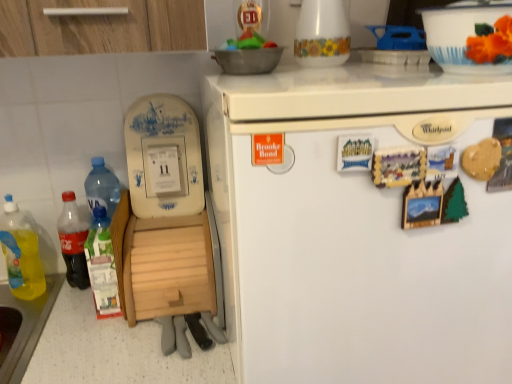
Measure the distance between point (423, 10) and camera.

1.07 meters.

What do you see at coordinates (73, 241) in the screenshot? I see `translucent plastic soda bottle at left, marked as the second bottle in a right-to-left arrangement` at bounding box center [73, 241].

The width and height of the screenshot is (512, 384). Identify the location of wooden at left. (170, 272).

Where is `white ceramic vase at upper center`? The image size is (512, 384). white ceramic vase at upper center is located at coordinates (322, 34).

Is wooden at left behind white ceramic vase at upper center?

Yes, wooden at left is behind white ceramic vase at upper center.

Is wooden at left inside or outside of white ceramic vase at upper center?

The correct answer is: outside.

Where is `appliance above the wooden at left (from a real-world perspective)`? The height and width of the screenshot is (384, 512). appliance above the wooden at left (from a real-world perspective) is located at coordinates (322, 34).

Is wooden at left directly adjacent to white ceramic vase at upper center?

No, wooden at left is not making contact with white ceramic vase at upper center.

From a real-world perspective, is translucent plastic soda bottle at left, marked as the second bottle in a right-to-left arrangement, over yellow translucent liquid at lower left, which appears as the 3th bottle when viewed from the right?

Yes, from a real-world perspective, translucent plastic soda bottle at left, marked as the second bottle in a right-to-left arrangement, is above yellow translucent liquid at lower left, which appears as the 3th bottle when viewed from the right.

Considering the sizes of objects translucent plastic soda bottle at left, marked as the second bottle in a right-to-left arrangement, and yellow translucent liquid at lower left, positioned as the first bottle in left-to-right order, in the image provided, who is bigger, translucent plastic soda bottle at left, marked as the second bottle in a right-to-left arrangement, or yellow translucent liquid at lower left, positioned as the first bottle in left-to-right order,?

With larger size is yellow translucent liquid at lower left, positioned as the first bottle in left-to-right order.

Is the surface of translucent plastic soda bottle at left, the second bottle viewed from the left, in direct contact with yellow translucent liquid at lower left, which appears as the 3th bottle when viewed from the right?

No, translucent plastic soda bottle at left, the second bottle viewed from the left, is not next to yellow translucent liquid at lower left, which appears as the 3th bottle when viewed from the right.

Is yellow translucent liquid at lower left, positioned as the first bottle in left-to-right order, at the back of translucent plastic soda bottle at left, the second bottle viewed from the left?

No, translucent plastic soda bottle at left, the second bottle viewed from the left, is not facing the opposite direction of yellow translucent liquid at lower left, positioned as the first bottle in left-to-right order.

Is white glossy bowl at upper right oriented towards wooden at left?

No, white glossy bowl at upper right is not aimed at wooden at left.

From a real-world perspective, which object rests below the other?

wooden at left.

Is white glossy bowl at upper right at the right side of wooden at left?

Indeed, white glossy bowl at upper right is positioned on the right side of wooden at left.

Which is behind, yellow translucent liquid at lower left, which appears as the 3th bottle when viewed from the right, or translucent plastic bottle at lower left, arranged as the first bottle when viewed from the right?

translucent plastic bottle at lower left, arranged as the first bottle when viewed from the right, is more distant.

Locate an element on the screen. bottle that is in front of the translucent plastic bottle at lower left, arranged as the first bottle when viewed from the right is located at coordinates (21, 253).

Is yellow translucent liquid at lower left, positioned as the first bottle in left-to-right order, with translucent plastic bottle at lower left, placed as the 3th bottle when sorted from left to right?

No, yellow translucent liquid at lower left, positioned as the first bottle in left-to-right order, is not touching translucent plastic bottle at lower left, placed as the 3th bottle when sorted from left to right.

From a real-world perspective, between white ceramic vase at upper center and wooden at left, who is vertically lower?

wooden at left is physically lower.

Consider the image. Would you say white ceramic vase at upper center is to the left or to the right of wooden at left in the picture?

Based on their positions, white ceramic vase at upper center is located to the right of wooden at left.

Is white ceramic vase at upper center oriented towards wooden at left?

No, white ceramic vase at upper center does not turn towards wooden at left.

I want to click on the 1st bottle positioned below the white glossy bowl at upper right (from a real-world perspective), so click(73, 241).

Is translucent plastic soda bottle at left, marked as the second bottle in a right-to-left arrangement, directly adjacent to white glossy bowl at upper right?

No, translucent plastic soda bottle at left, marked as the second bottle in a right-to-left arrangement, is not beside white glossy bowl at upper right.

From the image's perspective, is translucent plastic soda bottle at left, marked as the second bottle in a right-to-left arrangement, located beneath white glossy bowl at upper right?

Yes, from the image's perspective, translucent plastic soda bottle at left, marked as the second bottle in a right-to-left arrangement, is below white glossy bowl at upper right.

Does translucent plastic soda bottle at left, the second bottle viewed from the left, appear on the right side of white glossy bowl at upper right?

Incorrect, translucent plastic soda bottle at left, the second bottle viewed from the left, is not on the right side of white glossy bowl at upper right.

Locate an element on the screen. Image resolution: width=512 pixels, height=384 pixels. refrigerator located underneath the wooden at left (from a real-world perspective) is located at coordinates (357, 228).

Considering the sizes of objects wooden at left and white matte refrigerator at upper right in the image provided, who is bigger, wooden at left or white matte refrigerator at upper right?

Bigger between the two is white matte refrigerator at upper right.

Consider the image. From the image's perspective, which one is positioned lower, wooden at left or white matte refrigerator at upper right?

white matte refrigerator at upper right, from the image's perspective.

Is wooden at left to the left or to the right of white matte refrigerator at upper right in the image?

Clearly, wooden at left is on the left of white matte refrigerator at upper right in the image.

Identify the location of appliance above the wooden at left (from the image's perspective). (322, 34).

Where is `the 1st bottle to the right of the yellow translucent liquid at lower left, which appears as the 3th bottle when viewed from the right, starting your count from the anchor`? the 1st bottle to the right of the yellow translucent liquid at lower left, which appears as the 3th bottle when viewed from the right, starting your count from the anchor is located at coordinates (x=73, y=241).

When comparing their distances from translucent plastic soda bottle at left, the second bottle viewed from the left, does translucent plastic bottle at lower left, arranged as the first bottle when viewed from the right, or yellow translucent liquid at lower left, which appears as the 3th bottle when viewed from the right, seem closer?

Based on the image, yellow translucent liquid at lower left, which appears as the 3th bottle when viewed from the right, appears to be nearer to translucent plastic soda bottle at left, the second bottle viewed from the left.

Based on their spatial positions, is translucent plastic soda bottle at left, marked as the second bottle in a right-to-left arrangement, or translucent plastic bottle at lower left, arranged as the first bottle when viewed from the right, closer to yellow translucent liquid at lower left, which appears as the 3th bottle when viewed from the right?

translucent plastic soda bottle at left, marked as the second bottle in a right-to-left arrangement, is closer to yellow translucent liquid at lower left, which appears as the 3th bottle when viewed from the right.

Based on their spatial positions, is wooden at left or white ceramic vase at upper center closer to yellow translucent liquid at lower left, positioned as the first bottle in left-to-right order?

Among the two, wooden at left is located nearer to yellow translucent liquid at lower left, positioned as the first bottle in left-to-right order.

Estimate the real-world distances between objects in this image. Which object is further from wooden at left, white matte refrigerator at upper right or white glossy bowl at upper right?

Among the two, white glossy bowl at upper right is located further to wooden at left.

From the image, which object appears to be farther from yellow translucent liquid at lower left, which appears as the 3th bottle when viewed from the right, wooden at left or white matte refrigerator at upper right?

Among the two, white matte refrigerator at upper right is located further to yellow translucent liquid at lower left, which appears as the 3th bottle when viewed from the right.

Looking at the image, which one is located closer to wooden at left, yellow translucent liquid at lower left, which appears as the 3th bottle when viewed from the right, or translucent plastic soda bottle at left, the second bottle viewed from the left?

The object closer to wooden at left is translucent plastic soda bottle at left, the second bottle viewed from the left.

From the image, which object appears to be farther from translucent plastic soda bottle at left, the second bottle viewed from the left, yellow translucent liquid at lower left, positioned as the first bottle in left-to-right order, or translucent plastic bottle at lower left, placed as the 3th bottle when sorted from left to right?

translucent plastic bottle at lower left, placed as the 3th bottle when sorted from left to right, is positioned further to the anchor translucent plastic soda bottle at left, the second bottle viewed from the left.

When comparing their distances from wooden at left, does white glossy bowl at upper right or translucent plastic soda bottle at left, the second bottle viewed from the left, seem closer?

translucent plastic soda bottle at left, the second bottle viewed from the left, is closer to wooden at left.

You are a GUI agent. You are given a task and a screenshot of the screen. Output one action in this format:
    pyautogui.click(x=<x>, y=<y>)
    Task: Click on the drawer between yellow translucent liquid at lower left, which appears as the 3th bottle when viewed from the right, and white ceramic vase at upper center
    The height and width of the screenshot is (384, 512).
    Given the screenshot: What is the action you would take?
    pyautogui.click(x=170, y=272)

Where is `bottle between yellow translucent liquid at lower left, which appears as the 3th bottle when viewed from the right, and translucent plastic bottle at lower left, placed as the 3th bottle when sorted from left to right, from left to right`? Image resolution: width=512 pixels, height=384 pixels. bottle between yellow translucent liquid at lower left, which appears as the 3th bottle when viewed from the right, and translucent plastic bottle at lower left, placed as the 3th bottle when sorted from left to right, from left to right is located at coordinates (73, 241).

Identify the location of refrigerator between yellow translucent liquid at lower left, which appears as the 3th bottle when viewed from the right, and white glossy bowl at upper right from left to right. This screenshot has width=512, height=384. (357, 228).

You are a GUI agent. You are given a task and a screenshot of the screen. Output one action in this format:
    pyautogui.click(x=<x>, y=<y>)
    Task: Click on the appliance between translucent plastic bottle at lower left, arranged as the first bottle when viewed from the right, and white glossy bowl at upper right from left to right
    
    Given the screenshot: What is the action you would take?
    pyautogui.click(x=322, y=34)